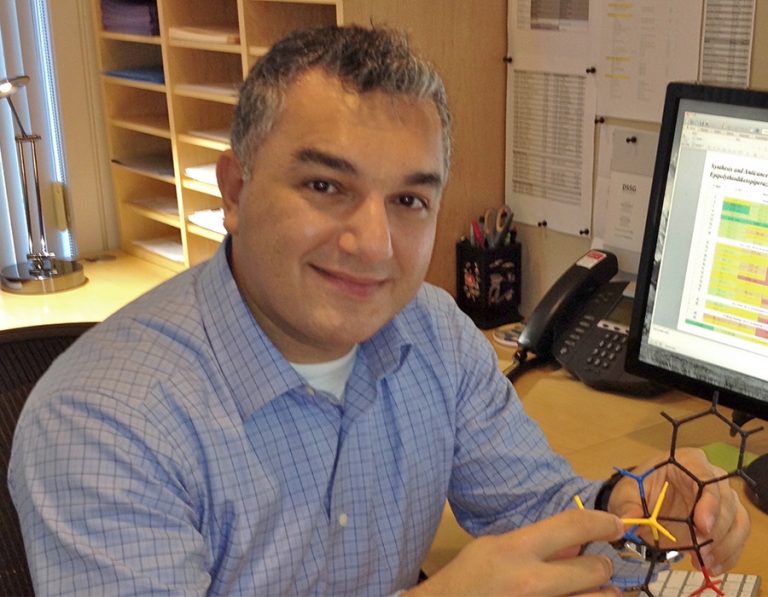
Locate an element on the screen. Image resolution: width=768 pixels, height=597 pixels. phone is located at coordinates (581, 322).